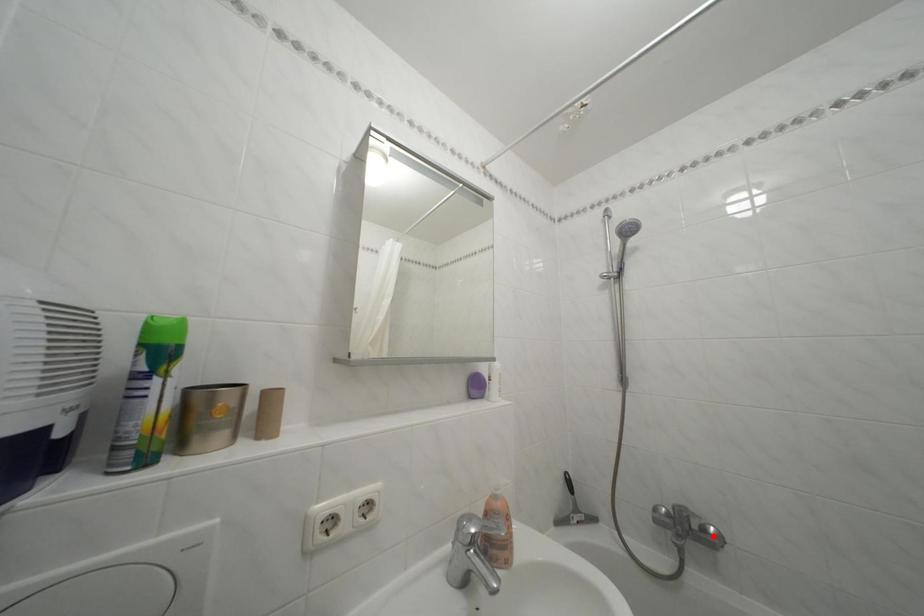
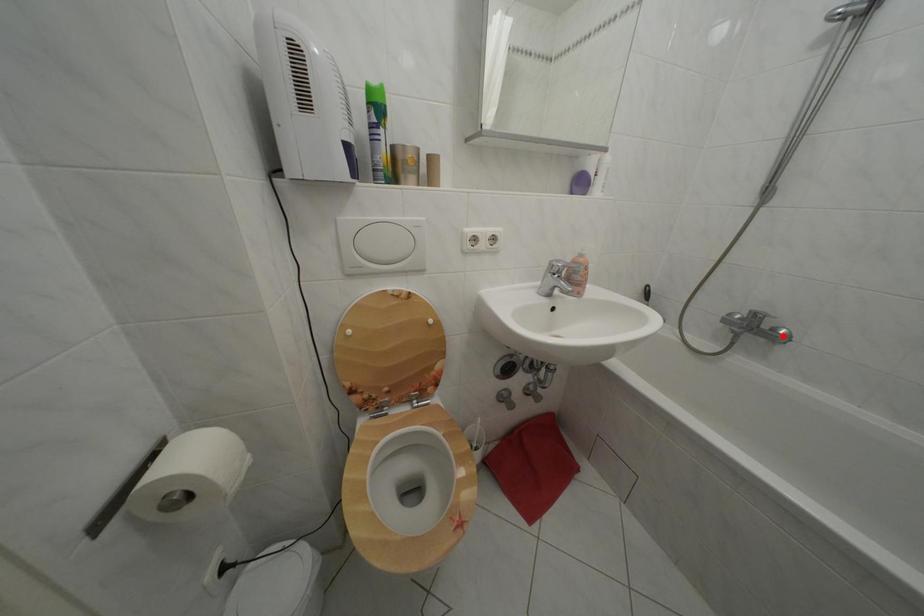
I am providing you with two images of the same scene from different viewpoints. A red point is marked on the first image and another point is marked on the second image. Does the point marked in image1 correspond to the same location as the one in image2?

Yes